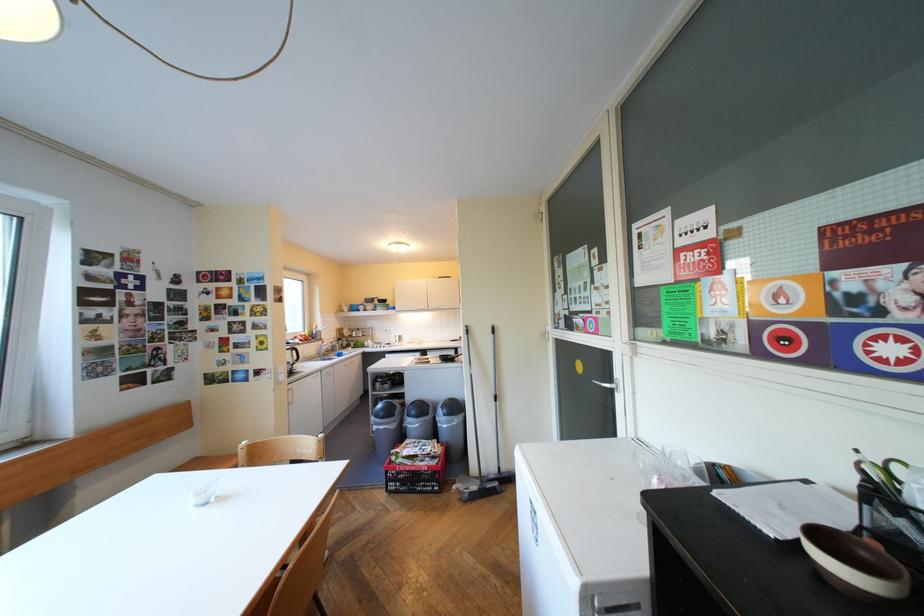
Identify the location of faucet handle. Image resolution: width=924 pixels, height=616 pixels. (327, 347).